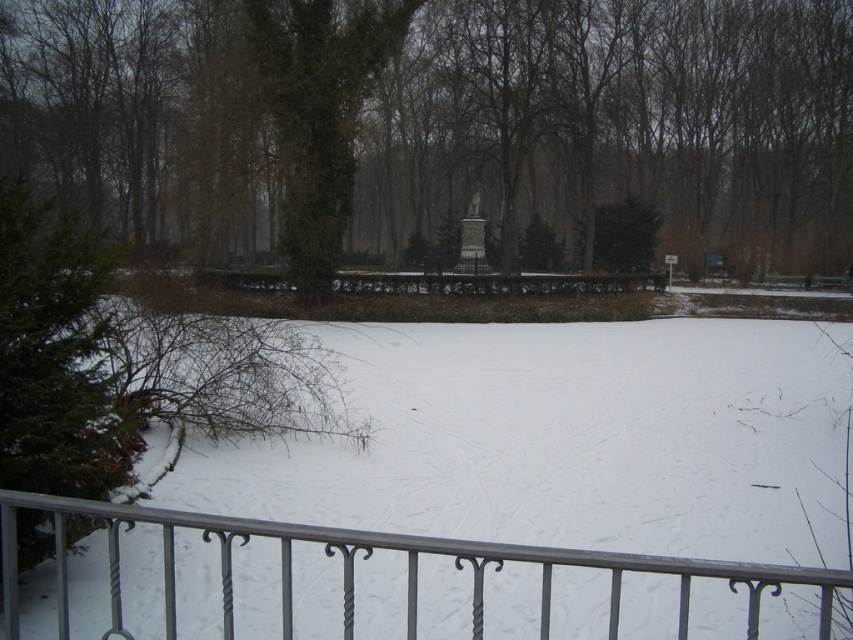
Question: Does green leafy tree at center appear on the right side of green ivy-covered tree at center?

Choices:
 (A) no
 (B) yes

Answer: (B)

Question: Which object is closer to the camera taking this photo?

Choices:
 (A) metallic silver fence at lower center
 (B) green leafy tree at center
 (C) green ivy-covered tree at center

Answer: (A)

Question: Considering the real-world distances, which object is farthest from the green leafy tree at center?

Choices:
 (A) green ivy-covered tree at center
 (B) metallic silver fence at lower center

Answer: (B)

Question: Does green leafy tree at center appear on the left side of green ivy-covered tree at center?

Choices:
 (A) no
 (B) yes

Answer: (A)

Question: Is green leafy tree at center behind green ivy-covered tree at center?

Choices:
 (A) no
 (B) yes

Answer: (A)

Question: Which of these objects is positioned farthest from the metallic silver fence at lower center?

Choices:
 (A) green ivy-covered tree at center
 (B) green leafy tree at center

Answer: (B)